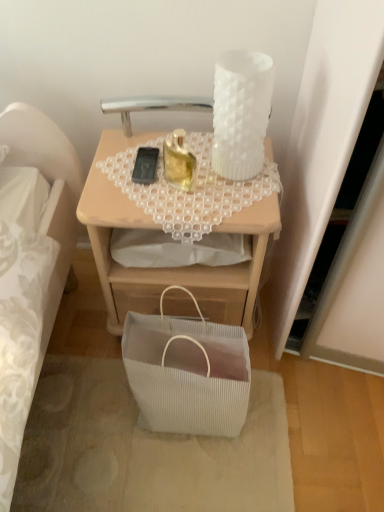
Where is `vacant area to the left of translucent glass candle at upper center, arranged as the first candle holder when viewed from the left`? vacant area to the left of translucent glass candle at upper center, arranged as the first candle holder when viewed from the left is located at coordinates (122, 181).